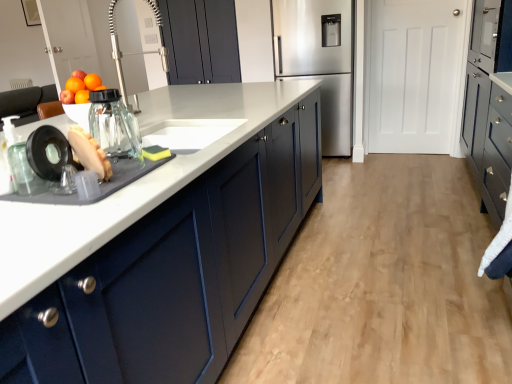
In order to face white matte door at upper right, should I rotate leftwards or rightwards?

Rotate your view right by about 20.095°.

Consider the image. In order to face black rubber ring at sink, the 2th appliance in the right-to-left sequence, should I rotate leftwards or rightwards?

A 25.607 degree turn to the left will do.

The height and width of the screenshot is (384, 512). What are the coordinates of `clear glass jar at sink, the 1th appliance from the right` in the screenshot? It's located at (114, 125).

How different are the orientations of matte blue cabinets at center and brown matte bread at left, which appears as the second food when viewed from the right, in degrees?

They differ by 63.1 degrees in their facing directions.

Find the location of a particular element. The width and height of the screenshot is (512, 384). plain that appears below the brown matte bread at left, which ranks as the second food in back-to-front order (from a real-world perspective) is located at coordinates (383, 284).

Is matte blue cabinets at center placed right next to brown matte bread at left, which appears as the second food when viewed from the right?

No, matte blue cabinets at center is not beside brown matte bread at left, which appears as the second food when viewed from the right.

From a real-world perspective, is matte blue cabinets at center physically above brown matte bread at left, placed as the 1th food when sorted from left to right?

No, from a real-world perspective, matte blue cabinets at center is not over brown matte bread at left, placed as the 1th food when sorted from left to right

In the image, is matte blue cabinets at center, the 2th cabinetry viewed from the right, positioned in front of or behind matte dark blue cabinet at upper center, the third cabinetry in the right-to-left sequence?

Clearly, matte blue cabinets at center, the 2th cabinetry viewed from the right, is in front of matte dark blue cabinet at upper center, the third cabinetry in the right-to-left sequence.

Is matte blue cabinets at center, the 2th cabinetry viewed from the right, situated inside matte dark blue cabinet at upper center, the third cabinetry in the right-to-left sequence, or outside?

matte blue cabinets at center, the 2th cabinetry viewed from the right, is not enclosed by matte dark blue cabinet at upper center, the third cabinetry in the right-to-left sequence.

Is matte blue cabinets at center, the 2th cabinetry viewed from the right, thinner than matte dark blue cabinet at upper center, acting as the first cabinetry starting from the left?

No.

From the picture: How different are the orientations of clear glass jar at sink, which is counted as the second appliance, starting from the left, and matte blue cabinets at center in degrees?

90.3 degrees separate the facing orientations of clear glass jar at sink, which is counted as the second appliance, starting from the left, and matte blue cabinets at center.

Is clear glass jar at sink, which is counted as the second appliance, starting from the left, positioned beyond the bounds of matte blue cabinets at center?

Yes, clear glass jar at sink, which is counted as the second appliance, starting from the left, is located beyond the bounds of matte blue cabinets at center.

Which object is closer to the camera, clear glass jar at sink, placed as the first appliance when sorted from back to front, or matte blue cabinets at center?

clear glass jar at sink, placed as the first appliance when sorted from back to front, is in front.

Considering the points (94, 123) and (372, 339), which point is in front, point (94, 123) or point (372, 339)?

The point (94, 123) is closer to the camera.

From the white matte door at upper right, count the 2nd food to the left and point to it. Please provide its 2D coordinates.

[(89, 153)]

Which object is positioned more to the right, white matte door at upper right or brown matte bread at left, which is counted as the 1th food, starting from the front?

white matte door at upper right is more to the right.

Between white matte door at upper right and brown matte bread at left, which ranks as the second food in back-to-front order, which one has more height?

With more height is white matte door at upper right.

Which is more to the right, white matte door at upper right or clear glass jar at sink, placed as the first appliance when sorted from back to front?

white matte door at upper right is more to the right.

How different are the orientations of white matte door at upper right and clear glass jar at sink, which is counted as the second appliance, starting from the left, in degrees?

92.2 degrees.

From the image's perspective, who appears lower, white matte door at upper right or clear glass jar at sink, which is counted as the second appliance, starting from the left?

clear glass jar at sink, which is counted as the second appliance, starting from the left, from the image's perspective.

Is white matte door at upper right oriented towards clear glass jar at sink, the 1th appliance from the right?

Yes, white matte door at upper right is facing clear glass jar at sink, the 1th appliance from the right.

Is point (301, 30) positioned in front of point (39, 134)?

No, it is not.

Does stainless steel refrigerator at center turn towards black rubber ring at sink, which is the first appliance from front to back?

Yes, stainless steel refrigerator at center is oriented towards black rubber ring at sink, which is the first appliance from front to back.

Can you confirm if stainless steel refrigerator at center is wider than black rubber ring at sink, the 2th appliance in the right-to-left sequence?

Yes.

How far apart are stainless steel refrigerator at center and black rubber ring at sink, the 1th appliance in the left-to-right sequence?

stainless steel refrigerator at center is 3.16 meters from black rubber ring at sink, the 1th appliance in the left-to-right sequence.

In terms of height, does black rubber ring at sink, which is counted as the second appliance, starting from the back, look taller or shorter compared to white matte door at upper right?

Clearly, black rubber ring at sink, which is counted as the second appliance, starting from the back, is shorter compared to white matte door at upper right.

Based on the photo, could you measure the distance between black rubber ring at sink, which is counted as the second appliance, starting from the back, and white matte door at upper right?

black rubber ring at sink, which is counted as the second appliance, starting from the back, and white matte door at upper right are 11.43 feet apart from each other.

Looking at this image, is black rubber ring at sink, the 1th appliance in the left-to-right sequence, inside the boundaries of white matte door at upper right, or outside?

black rubber ring at sink, the 1th appliance in the left-to-right sequence, is outside white matte door at upper right.

Relative to white matte door at upper right, is black rubber ring at sink, which is the first appliance from front to back, in front or behind?

Visually, black rubber ring at sink, which is the first appliance from front to back, is located in front of white matte door at upper right.

Image resolution: width=512 pixels, height=384 pixels. I want to click on plain to the right of brown matte bread at left, which is counted as the 1th food, starting from the front, so click(x=383, y=284).

Where is `the 2nd cabinetry behind the matte blue cabinets at center, the 2th cabinetry viewed from the right`? The image size is (512, 384). the 2nd cabinetry behind the matte blue cabinets at center, the 2th cabinetry viewed from the right is located at coordinates (201, 41).

When comparing their distances from brown matte bread at left, which ranks as the second food in back-to-front order, does white matte door at upper right or matte dark blue cabinet at right, the third cabinetry when ordered from left to right, seem further?

white matte door at upper right is positioned further to the anchor brown matte bread at left, which ranks as the second food in back-to-front order.

When comparing their distances from clear glass jar at sink, which is counted as the second appliance, starting from the left, does stainless steel refrigerator at center or white matte door at upper right seem closer?

stainless steel refrigerator at center lies closer to clear glass jar at sink, which is counted as the second appliance, starting from the left, than the other object.

Based on their spatial positions, is matte dark blue cabinet at right, the third cabinetry when ordered from left to right, or matte dark blue cabinet at upper center, acting as the first cabinetry starting from the left, further from yellow sponge at sink, which is the 1th food from back to front?

matte dark blue cabinet at upper center, acting as the first cabinetry starting from the left.

Which object lies nearer to the anchor point clear glass jar at sink, placed as the first appliance when sorted from back to front, white matte door at upper right or brown matte bread at left, which appears as the second food when viewed from the right?

The object closer to clear glass jar at sink, placed as the first appliance when sorted from back to front, is brown matte bread at left, which appears as the second food when viewed from the right.

Estimate the real-world distances between objects in this image. Which object is closer to matte dark blue cabinet at right, the third cabinetry when ordered from left to right, black rubber ring at sink, which is the first appliance from front to back, or clear glass jar at sink, placed as the first appliance when sorted from back to front?

clear glass jar at sink, placed as the first appliance when sorted from back to front, is closer to matte dark blue cabinet at right, the third cabinetry when ordered from left to right.

Looking at the image, which one is located further to clear glass jar at sink, placed as the first appliance when sorted from back to front, shiny glass jar at left or stainless steel refrigerator at center?

stainless steel refrigerator at center is positioned further to the anchor clear glass jar at sink, placed as the first appliance when sorted from back to front.

Based on the photo, considering their positions, is clear glass jar at sink, the 1th appliance from the right, positioned closer to brown matte bread at left, which ranks as the second food in back-to-front order, than white matte door at upper right?

Based on the image, clear glass jar at sink, the 1th appliance from the right, appears to be nearer to brown matte bread at left, which ranks as the second food in back-to-front order.

Estimate the real-world distances between objects in this image. Which object is closer to yellow sponge at sink, the 2th food viewed from the front, matte blue cabinets at center or matte blue cabinets at center, which is the 2th cabinetry from left to right?

Based on the image, matte blue cabinets at center, which is the 2th cabinetry from left to right, appears to be nearer to yellow sponge at sink, the 2th food viewed from the front.

I want to click on food located between clear glass jar at sink, the 1th appliance from the right, and matte blue cabinets at center in the left-right direction, so click(x=155, y=153).

This screenshot has width=512, height=384. I want to click on food between matte blue cabinets at center and white matte door at upper right in the front-back direction, so click(155, 153).

Image resolution: width=512 pixels, height=384 pixels. I want to click on plain between matte blue cabinets at center, which is the 2th cabinetry from left to right, and white matte door at upper right, along the z-axis, so click(383, 284).

Where is `food between black rubber ring at sink, which is counted as the second appliance, starting from the back, and clear glass jar at sink, the second appliance viewed from the front, in the front-back direction`? The width and height of the screenshot is (512, 384). food between black rubber ring at sink, which is counted as the second appliance, starting from the back, and clear glass jar at sink, the second appliance viewed from the front, in the front-back direction is located at coordinates (89, 153).